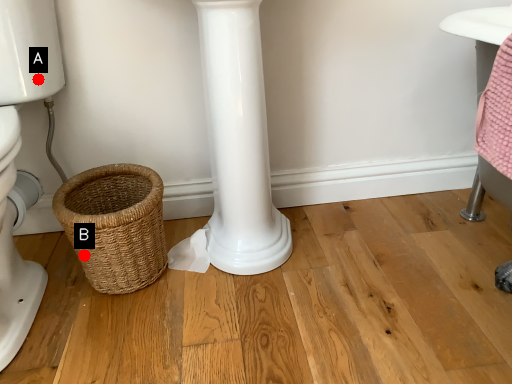
Question: Two points are circled on the image, labeled by A and B beside each circle. Which point is closer to the camera?

Choices:
 (A) A is closer
 (B) B is closer

Answer: (B)